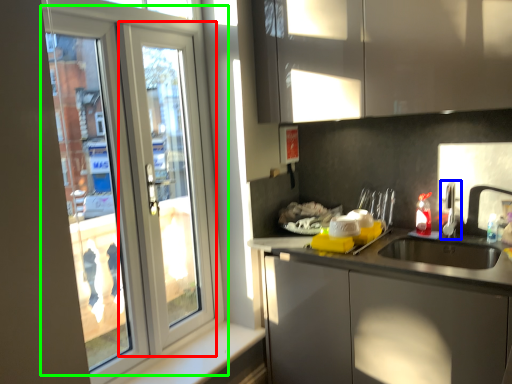
Question: Based on their relative distances, which object is nearer to screen door (highlighted by a red box)? Choose from tap (highlighted by a blue box) and door (highlighted by a green box).

Choices:
 (A) tap
 (B) door

Answer: (B)